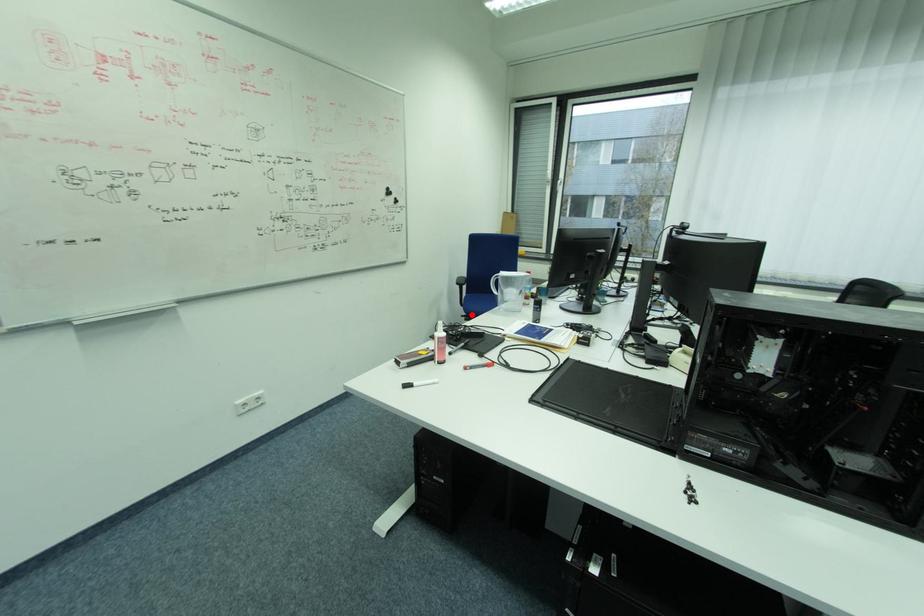
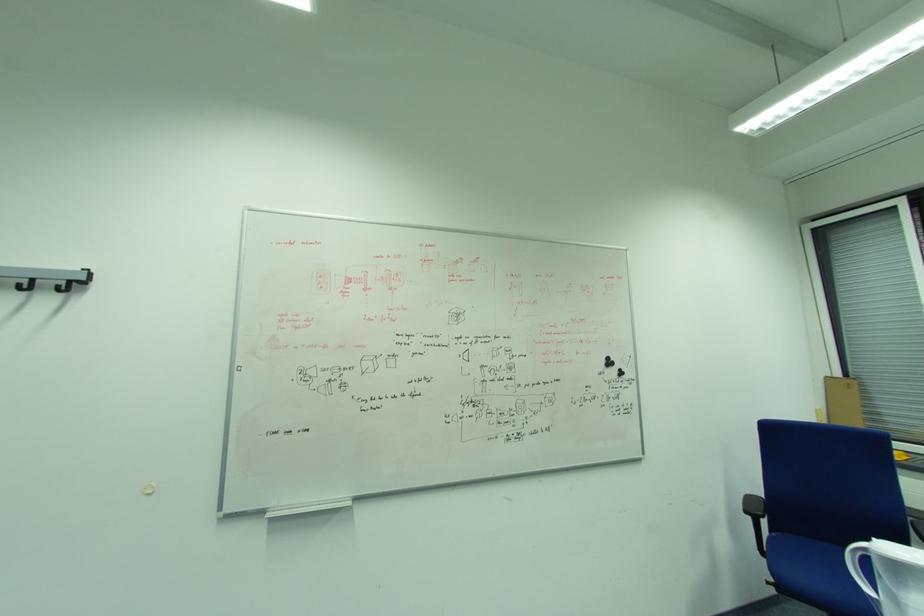
In the second image, find the point that corresponds to the highlighted location in the first image.

(782, 582)